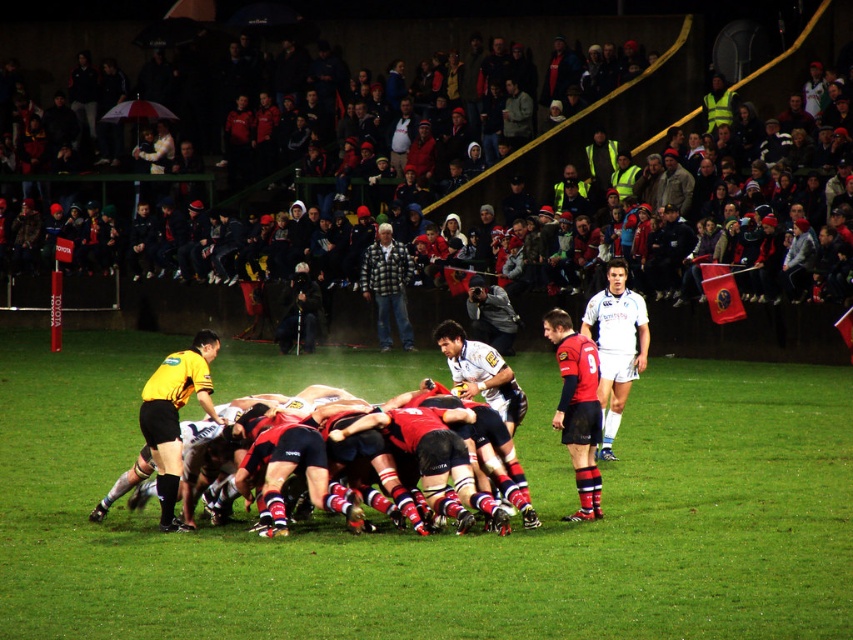
Who is more distant from viewer, (199, 392) or (379, 280)?

Positioned behind is point (379, 280).

How much distance is there between yellow jersey at center and plaid jacket at center?

The distance of yellow jersey at center from plaid jacket at center is 16.11 meters.

Locate an element on the screen. The image size is (853, 640). yellow jersey at center is located at coordinates (175, 413).

Measure the distance from red matte jersey at center to white jersey at center.

A distance of 2.55 meters exists between red matte jersey at center and white jersey at center.

Is red matte jersey at center shorter than white jersey at center?

Yes, red matte jersey at center is shorter than white jersey at center.

Who is more distant from viewer, (592, 362) or (645, 352)?

Positioned behind is point (645, 352).

This screenshot has width=853, height=640. I want to click on red matte jersey at center, so click(x=577, y=406).

Is point (634, 300) less distant than point (390, 288)?

That is True.

Looking at this image, does white jersey at center have a greater width compared to plaid jacket at center?

In fact, white jersey at center might be narrower than plaid jacket at center.

Describe the element at coordinates (616, 344) in the screenshot. The height and width of the screenshot is (640, 853). I see `white jersey at center` at that location.

What are the coordinates of `white jersey at center` in the screenshot? It's located at (616, 344).